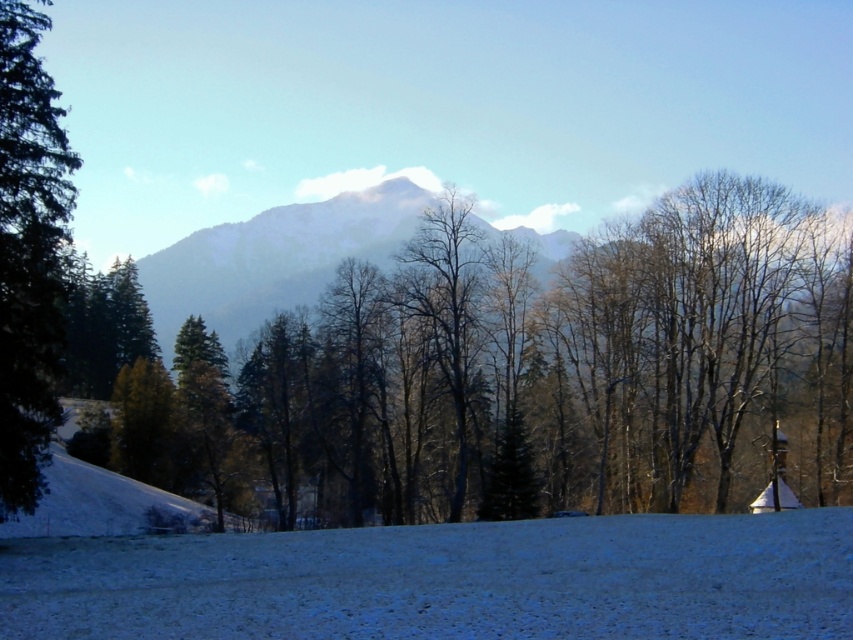
Which is behind, point (312, 598) or point (39, 260)?

Point (39, 260)

The height and width of the screenshot is (640, 853). In order to click on white snow at lower center in this screenshot , I will do `click(447, 580)`.